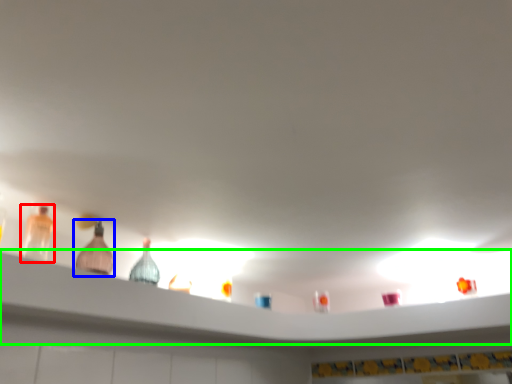
Question: Which object is the closest to the bottle (highlighted by a red box)? Choose among these: bottle (highlighted by a blue box) or shelf (highlighted by a green box).

Choices:
 (A) bottle
 (B) shelf

Answer: (A)